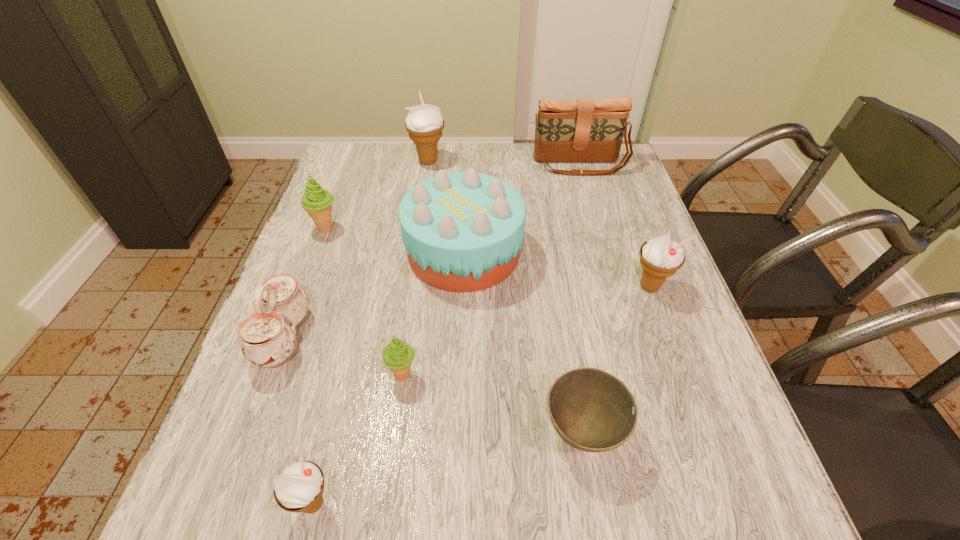
The height and width of the screenshot is (540, 960). Identify the location of the farthest icecream. (424, 123).

The width and height of the screenshot is (960, 540). In order to click on the tallest icecream in this screenshot , I will do `click(424, 123)`.

The width and height of the screenshot is (960, 540). I want to click on shoulder bag, so click(583, 130).

Locate an element on the screen. The width and height of the screenshot is (960, 540). cake is located at coordinates (463, 231).

The width and height of the screenshot is (960, 540). I want to click on the rightmost white icecream, so click(x=660, y=257).

This screenshot has height=540, width=960. I want to click on the second farthest white icecream, so click(660, 257).

At what (x,y) coordinates should I click in order to perform the action: click on the leftmost icecream. Please return your answer as a coordinate pair (x, y). Looking at the image, I should click on (317, 202).

The height and width of the screenshot is (540, 960). What are the coordinates of `the bigger green icecream` in the screenshot? It's located at (317, 202).

Identify the location of white chinaware. (268, 337).

Where is `the nearer green icecream`? the nearer green icecream is located at coordinates [398, 355].